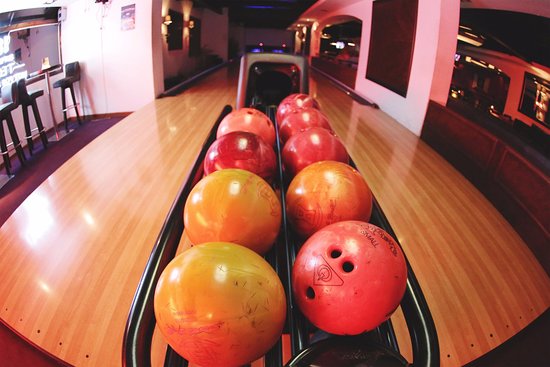
This screenshot has width=550, height=367. What are the coordinates of `walls` in the screenshot? It's located at (130, 55), (216, 44), (407, 105), (315, 41).